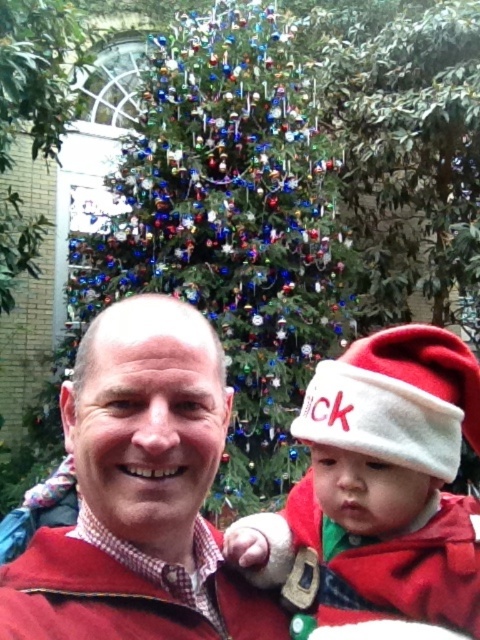
Does matte red sweater at center lie behind white fleece hat at center?

No, it is not.

Measure the distance between matte red sweater at center and white fleece hat at center.

matte red sweater at center is 5.54 inches from white fleece hat at center.

Does point (157, 520) lie behind point (464, 499)?

No, it is in front of (464, 499).

Identify the location of matte red sweater at center. click(140, 493).

Which is above, white fleece hat at center or maroon fleece jacket at center?

white fleece hat at center is above.

Between white fleece hat at center and maroon fleece jacket at center, which one has less height?

With less height is maroon fleece jacket at center.

Locate an element on the screen. This screenshot has width=480, height=640. white fleece hat at center is located at coordinates (377, 497).

Is shiny multicolored ornaments at center above white felt santa hat at right?

Yes.

The height and width of the screenshot is (640, 480). What do you see at coordinates (235, 221) in the screenshot?
I see `shiny multicolored ornaments at center` at bounding box center [235, 221].

Does point (268, 435) come closer to viewer compared to point (441, 358)?

That is False.

This screenshot has height=640, width=480. What are the coordinates of `shiny multicolored ornaments at center` in the screenshot? It's located at (235, 221).